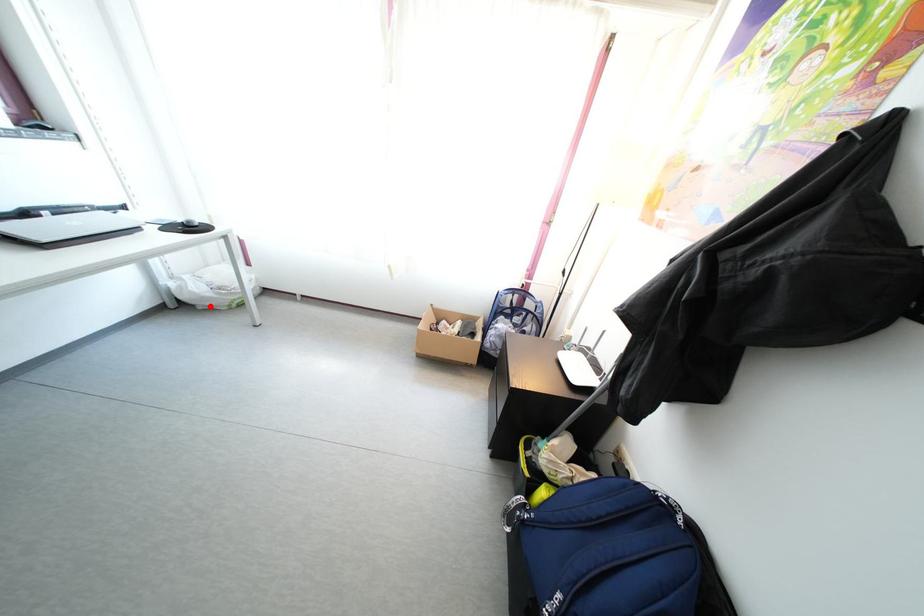
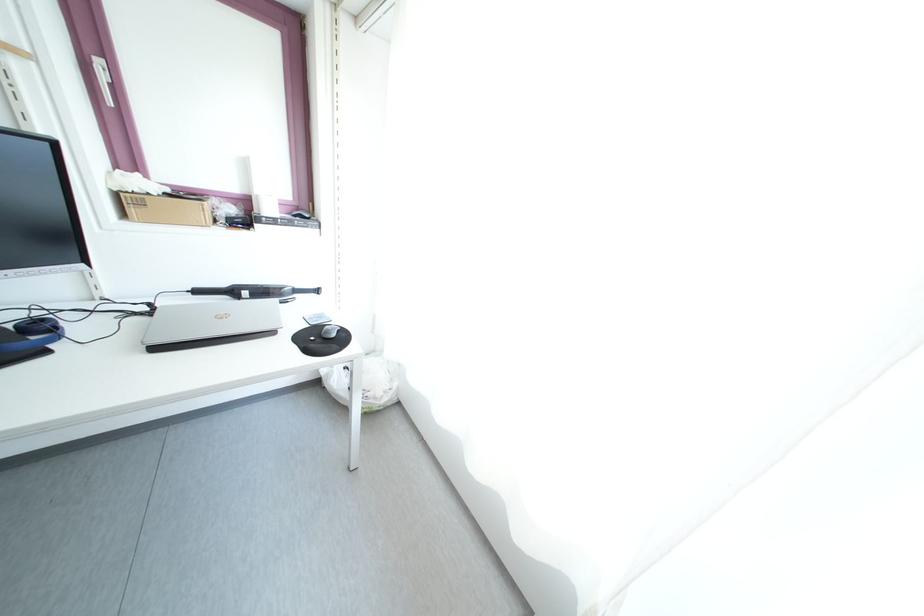
Where in the second image is the point corresponding to the highlighted location from the first image?

(344, 403)